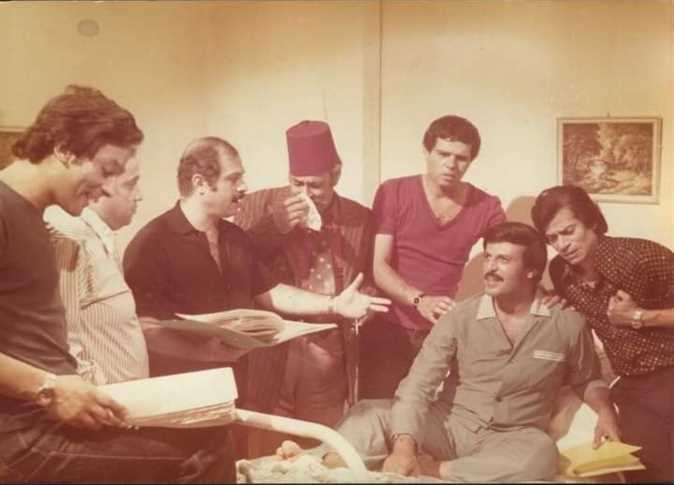
This screenshot has width=674, height=485. I want to click on backwall, so click(x=154, y=40), click(x=486, y=55).